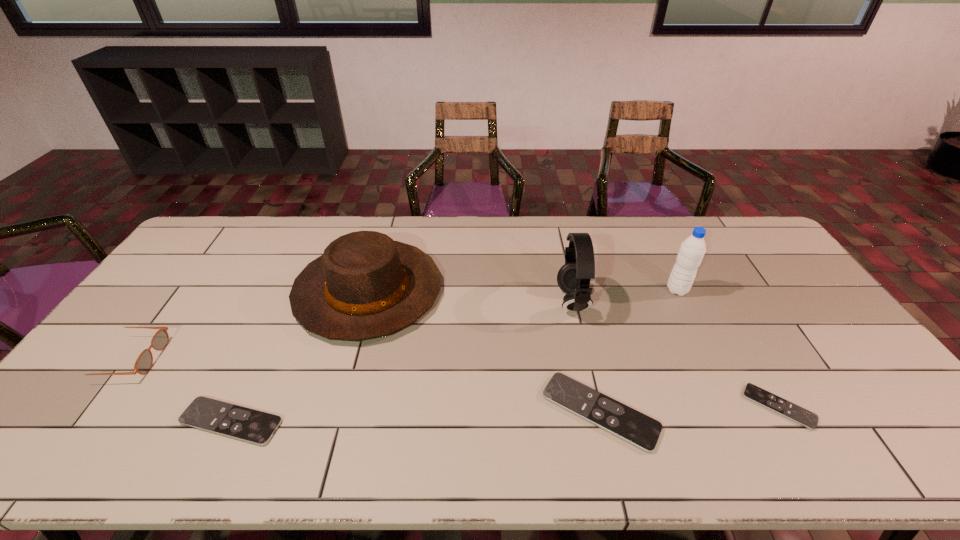
Find the location of `vacant area between the sunglasses and the second shortest object`. vacant area between the sunglasses and the second shortest object is located at coordinates pos(180,390).

Find the location of a particular element. free space that is in between the water bottle and the second shortest object is located at coordinates (454, 356).

This screenshot has height=540, width=960. I want to click on free space between the leftmost remote control and the water bottle, so click(x=454, y=356).

Image resolution: width=960 pixels, height=540 pixels. I want to click on vacant space in between the second remote control from right to left and the second shortest object, so click(416, 416).

At what (x,y) coordinates should I click in order to perform the action: click on vacant region between the fifth shortest object and the second remote control from right to left. Please return your answer as a coordinate pair (x, y). This screenshot has width=960, height=540. Looking at the image, I should click on (x=484, y=351).

Choose which object is the sixth nearest neighbor to the second remote control from left to right. Please provide its 2D coordinates. Your answer should be formatted as a tuple, i.e. [(x, y)], where the tuple contains the x and y coordinates of a point satisfying the conditions above.

[(144, 362)]

Where is `object that is the fourth closest one to the second remote control from right to left`? object that is the fourth closest one to the second remote control from right to left is located at coordinates (692, 250).

Select which remote control appears as the third closest to the leftmost object. Please provide its 2D coordinates. Your answer should be formatted as a tuple, i.e. [(x, y)], where the tuple contains the x and y coordinates of a point satisfying the conditions above.

[(804, 417)]

Select which remote control appears as the third closest to the water bottle. Please provide its 2D coordinates. Your answer should be formatted as a tuple, i.e. [(x, y)], where the tuple contains the x and y coordinates of a point satisfying the conditions above.

[(257, 427)]

In order to click on vacant space that satisfies the following two spatial constraints: 1. on the ear cups of the earphone; 2. on the left side of the second remote control from right to left in this screenshot , I will do `click(597, 411)`.